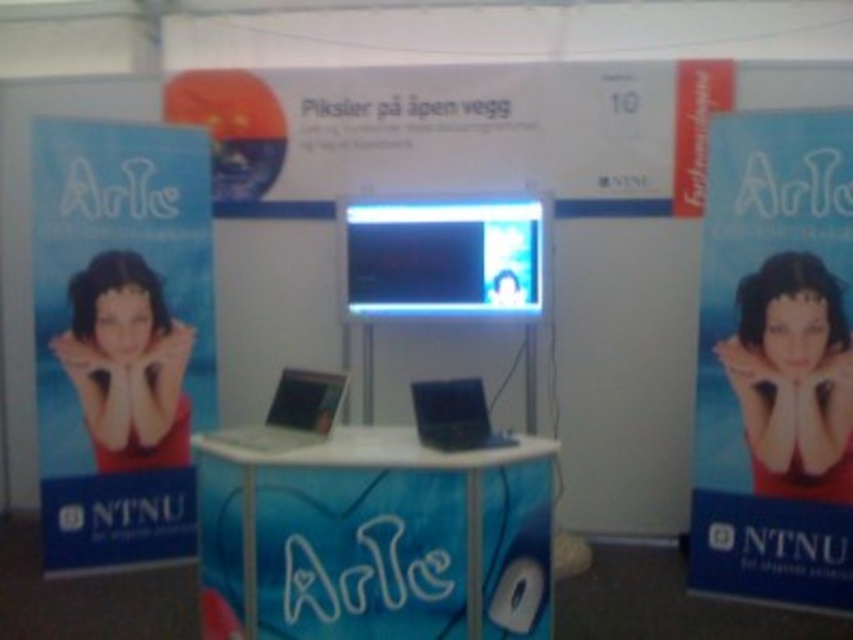
From the picture: Between matte red poster at center and shiny blue laptop at center, which one appears on the right side from the viewer's perspective?

From the viewer's perspective, matte red poster at center appears more on the right side.

Can you confirm if matte red poster at center is smaller than shiny blue laptop at center?

Actually, matte red poster at center might be larger than shiny blue laptop at center.

Is point (755, 340) positioned before point (436, 424)?

No, it is not.

At what (x,y) coordinates should I click in order to perform the action: click on matte red poster at center. Please return your answer as a coordinate pair (x, y). This screenshot has width=853, height=640. Looking at the image, I should click on (793, 378).

Is blue paper poster at left shorter than matte black laptop at center?

No.

Between blue paper poster at left and matte black laptop at center, which one appears on the right side from the viewer's perspective?

Positioned to the right is matte black laptop at center.

Who is more forward, (x=126, y=552) or (x=213, y=436)?

A: Point (x=213, y=436)

You are a GUI agent. You are given a task and a screenshot of the screen. Output one action in this format:
    pyautogui.click(x=<x>, y=<y>)
    Task: Click on the blue paper poster at left
    The height and width of the screenshot is (640, 853).
    Given the screenshot: What is the action you would take?
    pyautogui.click(x=120, y=337)

Which is behind, point (759, 148) or point (428, 532)?

Point (759, 148)

Which of these two, blue glossy poster at center or white glossy table at center, stands shorter?

white glossy table at center is shorter.

Where is `blue glossy poster at center`? The height and width of the screenshot is (640, 853). blue glossy poster at center is located at coordinates (775, 362).

Where is `blue glossy poster at center`? blue glossy poster at center is located at coordinates (775, 362).